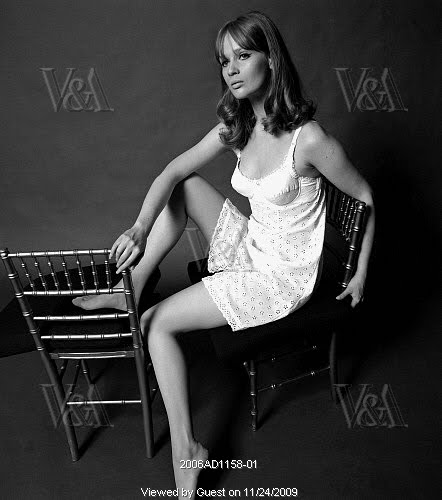
Where is `places to sit`? This screenshot has height=500, width=442. places to sit is located at coordinates (58, 307), (310, 323).